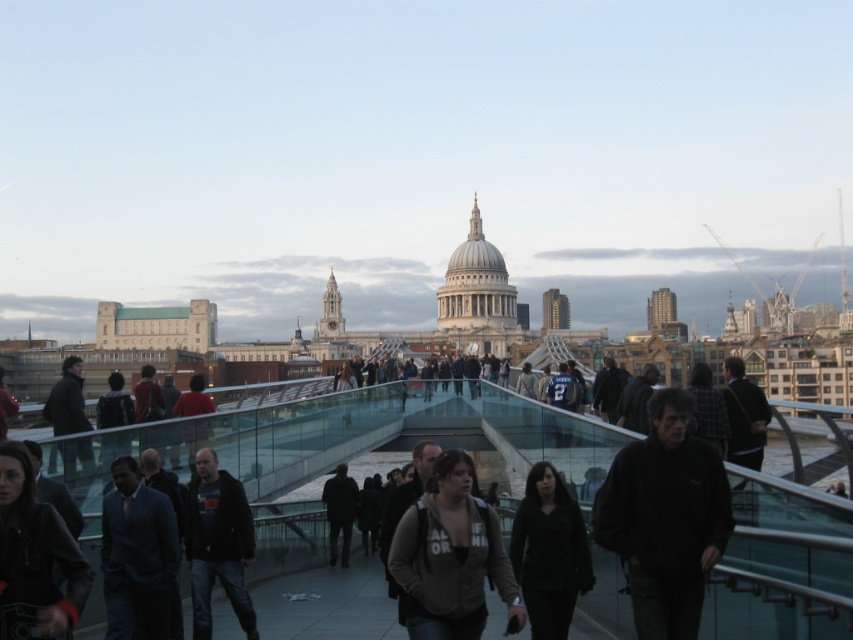
Question: Is dark gray hoodie at center to the left of dark blue sweater at center from the viewer's perspective?

Choices:
 (A) yes
 (B) no

Answer: (A)

Question: Which point appears farthest from the camera in this image?

Choices:
 (A) coord(421,557)
 (B) coord(728,362)
 (C) coord(332,545)

Answer: (C)

Question: Which object is closer to the camera taking this photo?

Choices:
 (A) dark brown leather jacket at left
 (B) dark gray jacket at center
 (C) dark brown leather jacket at center
 (D) dark blue suit at center

Answer: (C)

Question: Which of these objects is positioned farthest from the dark brown leather jacket at left?

Choices:
 (A) dark blue suit at center
 (B) dark brown leather jacket at center

Answer: (B)

Question: Can you confirm if dark blue suit at center is smaller than dark gray hoodie at center?

Choices:
 (A) yes
 (B) no

Answer: (A)

Question: In this image, where is dark gray fabric jacket at center located relative to dark brown leather jacket at left?

Choices:
 (A) left
 (B) right

Answer: (B)